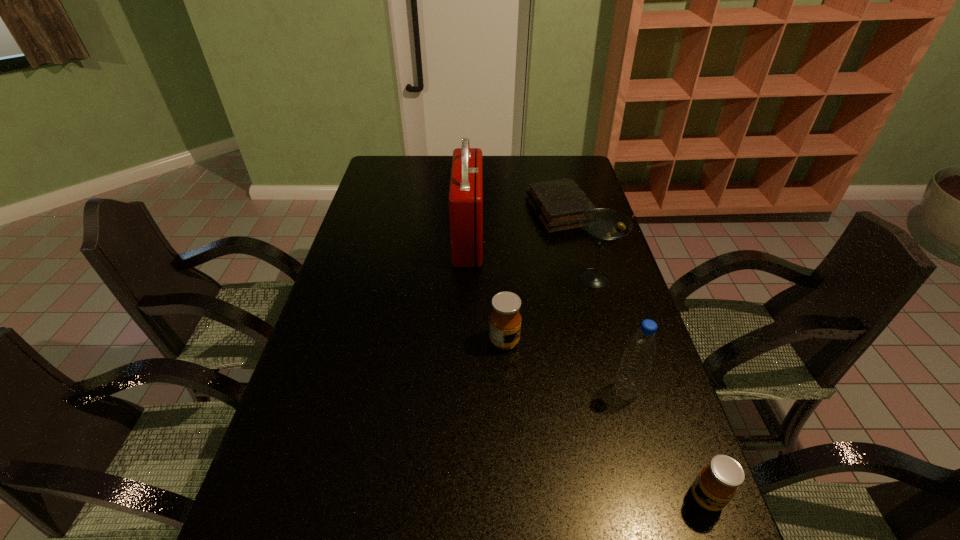
Where is `unoccupied area between the martini and the fourth tallest object`? unoccupied area between the martini and the fourth tallest object is located at coordinates (549, 310).

Where is `empty space between the first-aid kit and the second shortest object`? The height and width of the screenshot is (540, 960). empty space between the first-aid kit and the second shortest object is located at coordinates (588, 368).

The width and height of the screenshot is (960, 540). What are the coordinates of `free space that is in between the nearer honey and the fifth farthest object` in the screenshot? It's located at (666, 444).

The height and width of the screenshot is (540, 960). Identify the location of vacant space in between the martini and the tallest object. (531, 259).

At what (x,y) coordinates should I click in order to perform the action: click on object that ranks as the second closest to the right honey. Please return your answer as a coordinate pair (x, y). The height and width of the screenshot is (540, 960). Looking at the image, I should click on (505, 319).

Identify which object is located as the fourth nearest to the taller honey. Please provide its 2D coordinates. Your answer should be formatted as a tuple, i.e. [(x, y)], where the tuple contains the x and y coordinates of a point satisfying the conditions above.

[(558, 204)]

Find the location of a particular element. free space that satisfies the following two spatial constraints: 1. on the front side of the book; 2. on the front face of the tallest object is located at coordinates (567, 239).